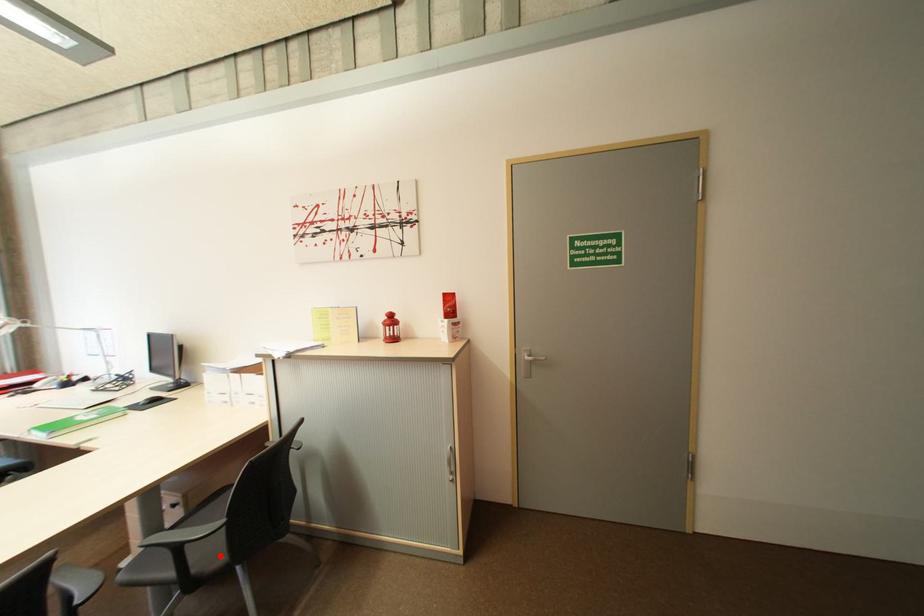
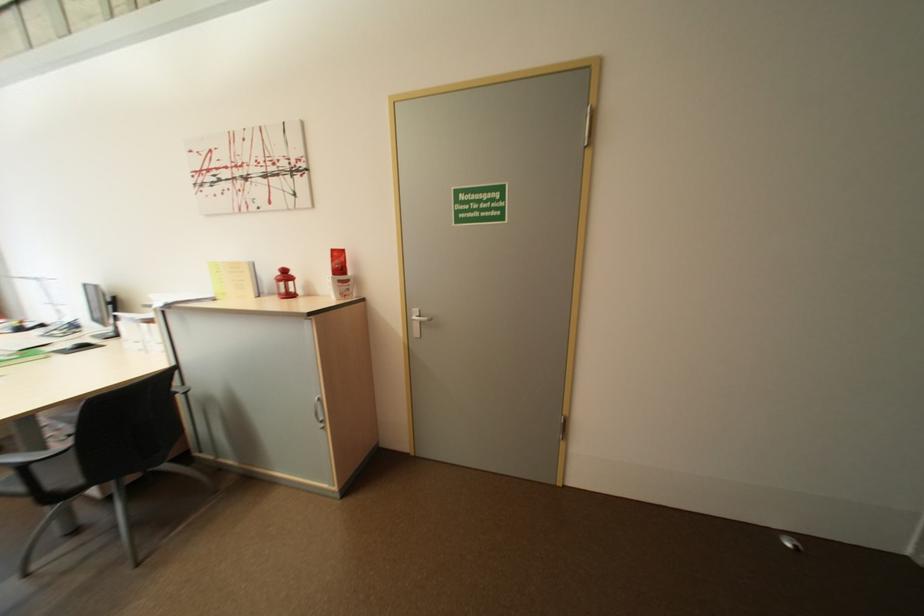
Locate, in the second image, the point that corresponds to the highlighted location in the first image.

(75, 477)